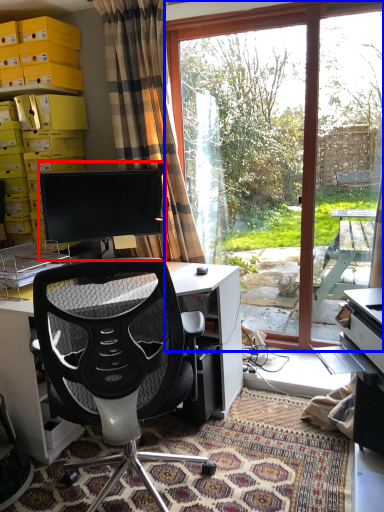
Question: Which point is closer to the camera, computer monitor (highlighted by a red box) or window (highlighted by a blue box)?

Choices:
 (A) computer monitor
 (B) window

Answer: (A)